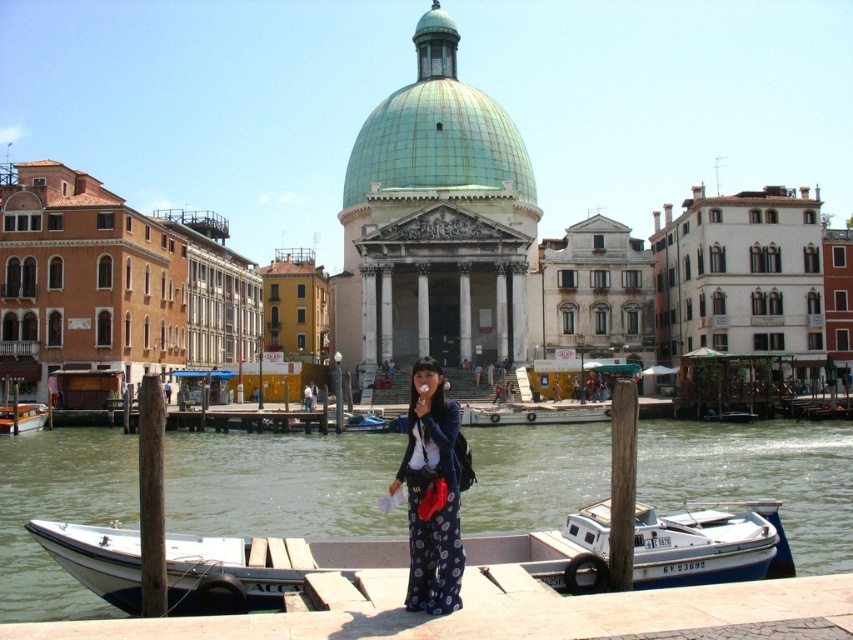
Question: Which point appears closest to the camera in this image?

Choices:
 (A) (13, 410)
 (B) (351, 420)
 (C) (440, 634)

Answer: (C)

Question: Does white matte boat at lower center appear under smooth concrete dock at lower center?

Choices:
 (A) no
 (B) yes

Answer: (A)

Question: Which point is farther to the camera?

Choices:
 (A) (381, 417)
 (B) (38, 416)

Answer: (A)

Question: From the image, what is the correct spatial relationship of green copper dome at center in relation to blue printed skirt at center?

Choices:
 (A) left
 (B) right

Answer: (B)

Question: Which point is closer to the camera taking this photo?

Choices:
 (A) (405, 467)
 (B) (370, 413)
 (C) (4, 433)

Answer: (A)

Question: Is smooth concrete dock at lower center bigger than white wooden boat at lower left?

Choices:
 (A) yes
 (B) no

Answer: (A)